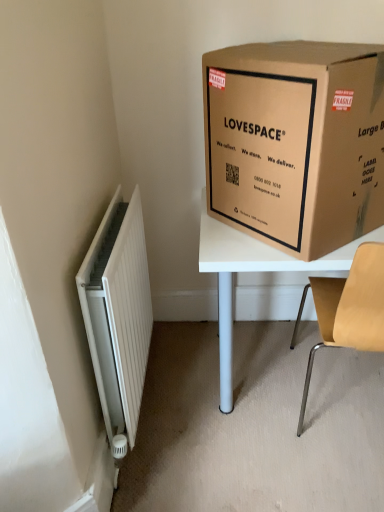
Describe the element at coordinates (296, 142) in the screenshot. The image size is (384, 512). I see `brown cardboard box at upper right` at that location.

What is the approximate height of brown cardboard box at upper right?

It is 20.89 inches.

Find the location of a particular element. This screenshot has height=512, width=384. brown cardboard box at upper right is located at coordinates (x=296, y=142).

From the image's perspective, is white ribbed radiator at left on top of light brown wood chair at right?

Yes.

Is white ribbed radiator at left positioned before light brown wood chair at right?

No, the depth of white ribbed radiator at left is greater than that of light brown wood chair at right.

Is white ribbed radiator at left taller than light brown wood chair at right?

Incorrect, the height of white ribbed radiator at left is not larger of that of light brown wood chair at right.

Consider the image. Are light brown wood chair at right and white ribbed radiator at left located far from each other?

They are positioned close to each other.

Considering the positions of objects light brown wood chair at right and white ribbed radiator at left in the image provided, who is more to the left, light brown wood chair at right or white ribbed radiator at left?

white ribbed radiator at left is more to the left.

How different are the orientations of light brown wood chair at right and white ribbed radiator at left in degrees?

The angle between the facing direction of light brown wood chair at right and the facing direction of white ribbed radiator at left is 85.3 degrees.

Between light brown wood chair at right and white ribbed radiator at left, which one has smaller size?

white ribbed radiator at left is smaller.

Between light brown wood chair at right and brown cardboard box at upper right, which one has less height?

Standing shorter between the two is brown cardboard box at upper right.

Is light brown wood chair at right facing towards brown cardboard box at upper right?

No, light brown wood chair at right is not aimed at brown cardboard box at upper right.

From the image's perspective, which is above, light brown wood chair at right or brown cardboard box at upper right?

From the image's view, brown cardboard box at upper right is above.

Locate an element on the screen. box located above the light brown wood chair at right (from a real-world perspective) is located at coordinates (296, 142).

Considering the points (306, 259) and (306, 395), which point is in front, point (306, 259) or point (306, 395)?

Point (306, 259)

Does brown cardboard box at upper right have a larger size compared to light brown wood chair at right?

Incorrect, brown cardboard box at upper right is not larger than light brown wood chair at right.

Which object is further away from the camera taking this photo, brown cardboard box at upper right or light brown wood chair at right?

light brown wood chair at right is further from the camera.

How much distance is there between white ribbed radiator at left and brown cardboard box at upper right?

white ribbed radiator at left is 21.53 inches from brown cardboard box at upper right.

Is white ribbed radiator at left bigger or smaller than brown cardboard box at upper right?

Considering their sizes, white ribbed radiator at left takes up less space than brown cardboard box at upper right.

Is brown cardboard box at upper right at the back of white ribbed radiator at left?

white ribbed radiator at left does not have its back to brown cardboard box at upper right.

Is white ribbed radiator at left positioned beyond the bounds of brown cardboard box at upper right?

Indeed, white ribbed radiator at left is completely outside brown cardboard box at upper right.

Can you confirm if brown cardboard box at upper right is positioned to the right of white ribbed radiator at left?

Yes.

From a real-world perspective, does brown cardboard box at upper right sit lower than white ribbed radiator at left?

Incorrect, from a real-world perspective, brown cardboard box at upper right is higher than white ribbed radiator at left.

From the image's perspective, is brown cardboard box at upper right over white ribbed radiator at left?

Correct, brown cardboard box at upper right appears higher than white ribbed radiator at left in the image.

Where is `chair on the right of white ribbed radiator at left`? This screenshot has height=512, width=384. chair on the right of white ribbed radiator at left is located at coordinates (350, 309).

Find the location of a particular element. The height and width of the screenshot is (512, 384). radiator on the left of light brown wood chair at right is located at coordinates (118, 313).

Based on their spatial positions, is brown cardboard box at upper right or light brown wood chair at right closer to white ribbed radiator at left?

Based on the image, brown cardboard box at upper right appears to be nearer to white ribbed radiator at left.

Based on the photo, looking at the image, which one is located further to light brown wood chair at right, brown cardboard box at upper right or white ribbed radiator at left?

white ribbed radiator at left.

Considering their positions, is white ribbed radiator at left positioned further to light brown wood chair at right than brown cardboard box at upper right?

The object further to light brown wood chair at right is white ribbed radiator at left.

Looking at the image, which one is located further to brown cardboard box at upper right, light brown wood chair at right or white ribbed radiator at left?

white ribbed radiator at left is positioned further to the anchor brown cardboard box at upper right.

Which object lies further to the anchor point white ribbed radiator at left, light brown wood chair at right or brown cardboard box at upper right?

The object further to white ribbed radiator at left is light brown wood chair at right.

When comparing their distances from brown cardboard box at upper right, does white ribbed radiator at left or light brown wood chair at right seem further?

white ribbed radiator at left is positioned further to the anchor brown cardboard box at upper right.

At what (x,y) coordinates should I click in order to perform the action: click on box between white ribbed radiator at left and light brown wood chair at right. Please return your answer as a coordinate pair (x, y). The image size is (384, 512). Looking at the image, I should click on (296, 142).